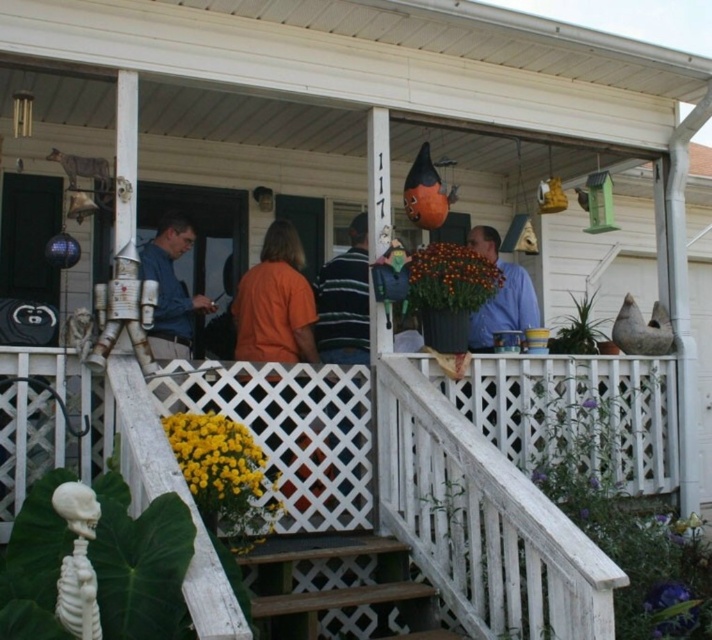
Question: Estimate the real-world distances between objects in this image. Which object is farther from the orange t-shirt at center?

Choices:
 (A) white lattice at center
 (B) blue matte shirt at center

Answer: (B)

Question: Which point is farther to the camera?

Choices:
 (A) blue matte shirt at center
 (B) blue fabric shirt at center
 (C) wooden stairs at lower center
 (D) orange t-shirt at center

Answer: (A)

Question: Is white lattice at center below blue matte shirt at center?

Choices:
 (A) yes
 (B) no

Answer: (A)

Question: Which of the following is the closest to the observer?

Choices:
 (A) (392, 547)
 (B) (261, 355)

Answer: (A)

Question: Can you confirm if orange t-shirt at center is positioned above blue matte shirt at center?

Choices:
 (A) yes
 (B) no

Answer: (B)

Question: Does wooden stairs at lower center have a smaller size compared to orange t-shirt at center?

Choices:
 (A) no
 (B) yes

Answer: (A)